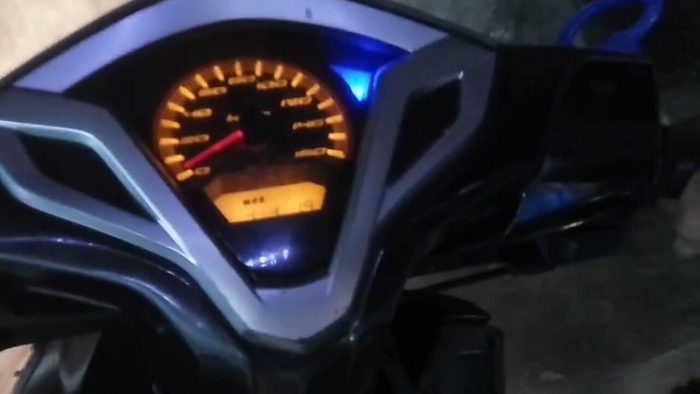
Where is `white wall`? The height and width of the screenshot is (394, 700). white wall is located at coordinates (18, 13).